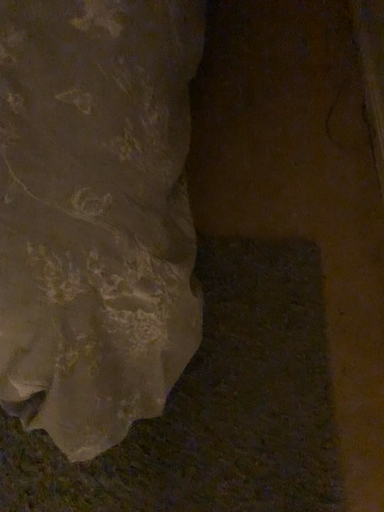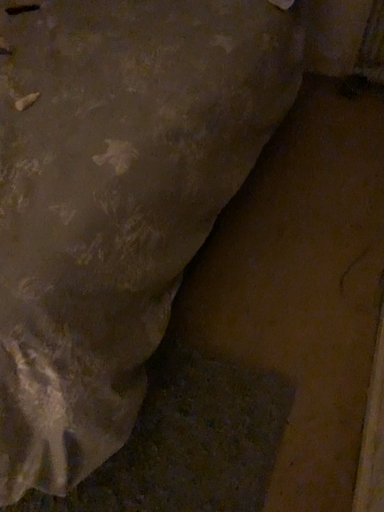
Question: How did the camera likely rotate when shooting the video?

Choices:
 (A) rotated downward
 (B) rotated upward

Answer: (B)